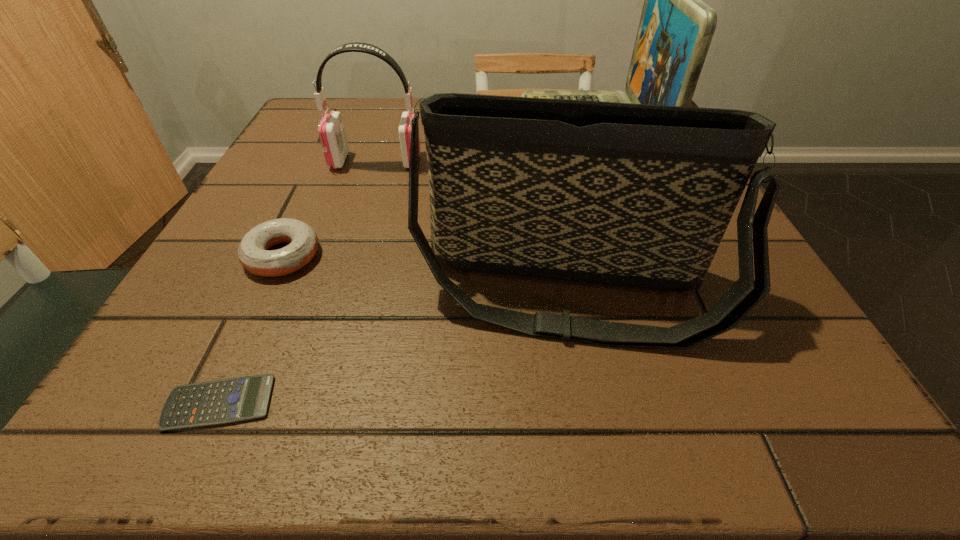
Find the location of a particular element. This screenshot has width=960, height=540. laptop computer is located at coordinates (676, 27).

You are a GUI agent. You are given a task and a screenshot of the screen. Output one action in this format:
    pyautogui.click(x=<x>, y=<y>)
    Task: Click on the handbag
    This screenshot has width=960, height=540.
    Given the screenshot: What is the action you would take?
    pyautogui.click(x=637, y=195)

The image size is (960, 540). Identify the location of earphone. (331, 131).

You are a GUI agent. You are given a task and a screenshot of the screen. Output one action in this format:
    pyautogui.click(x=<x>, y=<y>)
    Task: Click on the doughnut
    This screenshot has width=960, height=540.
    Given the screenshot: What is the action you would take?
    pyautogui.click(x=253, y=253)

Locate an element on the screen. the shortest object is located at coordinates (230, 400).

You are a GUI agent. You are given a task and a screenshot of the screen. Output one action in this format:
    pyautogui.click(x=<x>, y=<y>)
    Task: Click on the calculator
    
    Given the screenshot: What is the action you would take?
    pyautogui.click(x=230, y=400)

Where is `vacant region located 0.280m on the screen of the laptop computer`? Image resolution: width=960 pixels, height=540 pixels. vacant region located 0.280m on the screen of the laptop computer is located at coordinates (401, 130).

The image size is (960, 540). In order to click on vacant position located on the screen of the laptop computer in this screenshot , I will do `click(371, 130)`.

At what (x,y) coordinates should I click in order to perform the action: click on blank space located 0.250m on the screen of the laptop computer. Please return your answer as a coordinate pair (x, y). Looking at the image, I should click on (415, 130).

What are the coordinates of `vacant space located on the left of the handbag` in the screenshot? It's located at (294, 291).